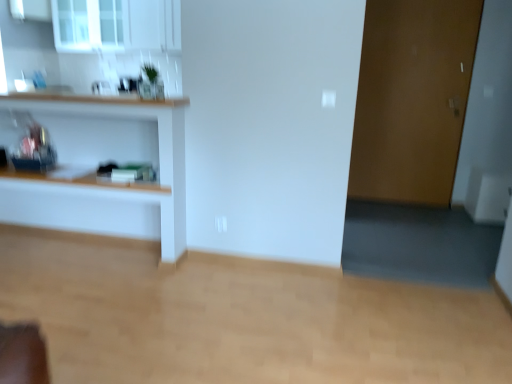
In the image, there is a brown matte door at right. From a real-world perspective, locate several spots within the vacant space situated above brown matte door at right. Your answer should be formatted as a list of tuples, i.e. [(x1, y1)], where each tuple contains the x and y coordinates of a point satisfying the conditions above.

[(0.830, -0.001)]